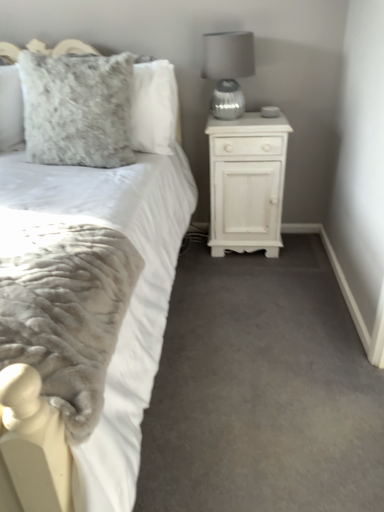
Question: Is fuzzy gray pillow at upper left a part of white wood nightstand at right?

Choices:
 (A) no
 (B) yes

Answer: (A)

Question: Is white wood nightstand at right aimed at fuzzy gray pillow at upper left?

Choices:
 (A) yes
 (B) no

Answer: (B)

Question: Is white wood nightstand at right outside of fuzzy gray pillow at upper left?

Choices:
 (A) yes
 (B) no

Answer: (A)

Question: From the image's perspective, is white wood nightstand at right above fuzzy gray pillow at upper left?

Choices:
 (A) yes
 (B) no

Answer: (B)

Question: Does white wood nightstand at right have a larger size compared to fuzzy gray pillow at upper left?

Choices:
 (A) yes
 (B) no

Answer: (A)

Question: From a real-world perspective, does white wood nightstand at right stand above fuzzy gray pillow at upper left?

Choices:
 (A) yes
 (B) no

Answer: (B)

Question: From the image's perspective, is white plush bed at center below satin silver lamp at upper right?

Choices:
 (A) no
 (B) yes

Answer: (B)

Question: Is white plush bed at center far from satin silver lamp at upper right?

Choices:
 (A) yes
 (B) no

Answer: (B)

Question: Is white plush bed at center touching satin silver lamp at upper right?

Choices:
 (A) yes
 (B) no

Answer: (B)

Question: From the image's perspective, does white plush bed at center appear higher than satin silver lamp at upper right?

Choices:
 (A) yes
 (B) no

Answer: (B)

Question: Is white plush bed at center smaller than satin silver lamp at upper right?

Choices:
 (A) no
 (B) yes

Answer: (A)

Question: Is white plush bed at center oriented away from satin silver lamp at upper right?

Choices:
 (A) yes
 (B) no

Answer: (B)

Question: Is satin silver lamp at upper right in front of fuzzy gray pillow at upper left?

Choices:
 (A) yes
 (B) no

Answer: (B)